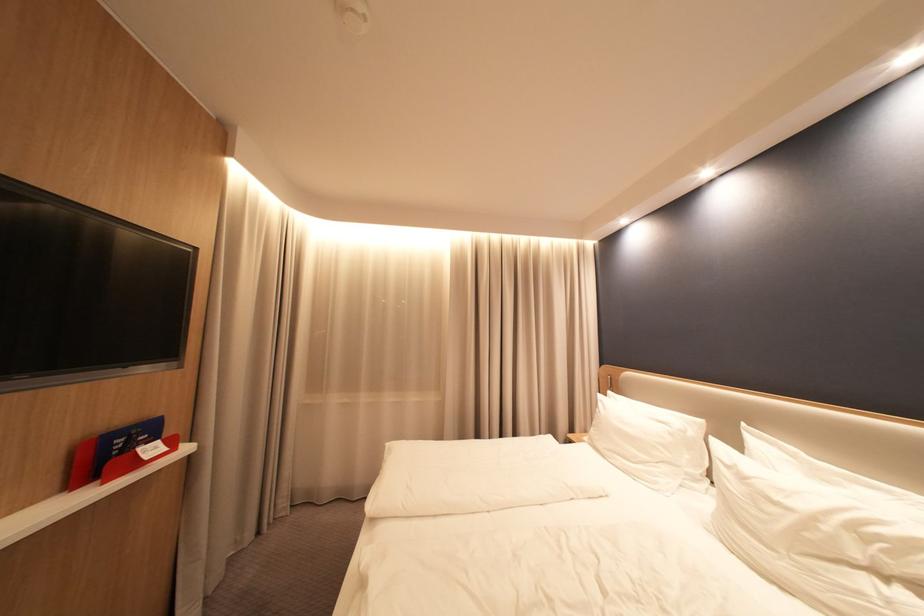
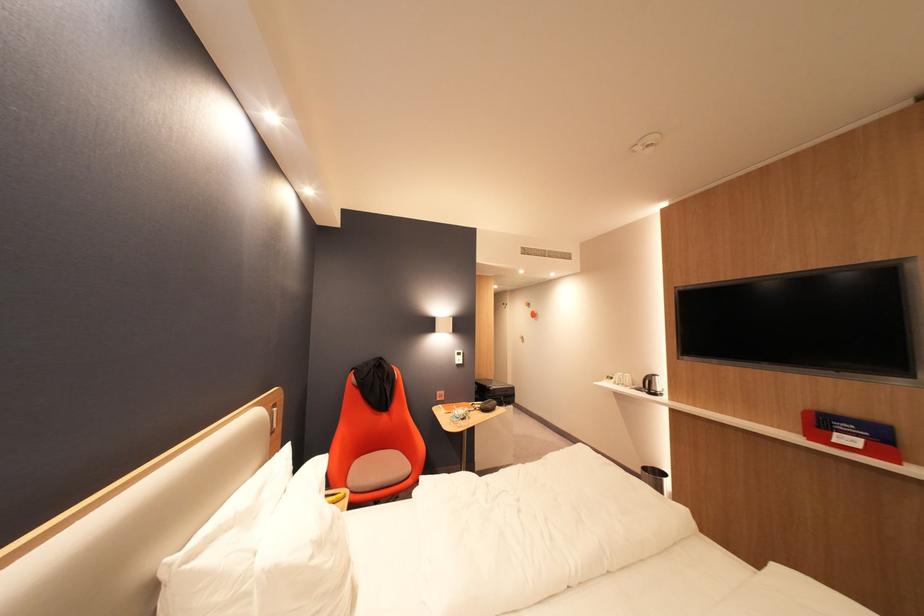
Locate, in the second image, the point that corresponds to point (150, 452) in the first image.

(846, 435)